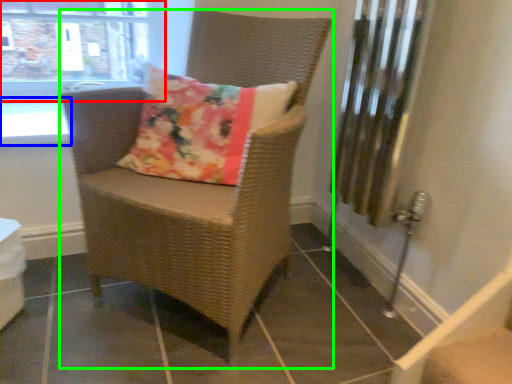
Question: Which object is positioned farthest from window (highlighted by a red box)? Select from window sill (highlighted by a blue box) and chair (highlighted by a green box).

Choices:
 (A) window sill
 (B) chair

Answer: (B)